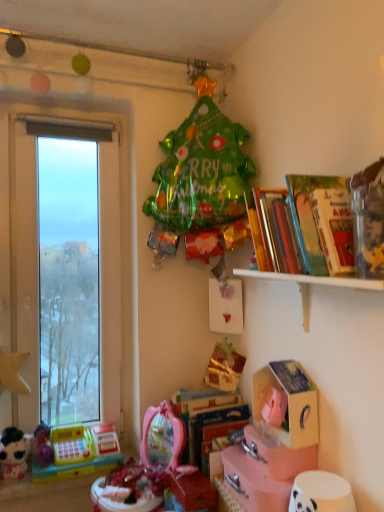
Question: Is shiny pink toy at center, which appears as the 2th toy when viewed from the right, positioned behind hardcover book at center, the 2th book in the front-to-back sequence?

Choices:
 (A) yes
 (B) no

Answer: (B)

Question: Considering the relative positions of shiny pink toy at center, which appears as the 2th toy when viewed from the right, and hardcover book at center, which is counted as the 2th book, starting from the top, in the image provided, is shiny pink toy at center, which appears as the 2th toy when viewed from the right, in front of hardcover book at center, which is counted as the 2th book, starting from the top,?

Choices:
 (A) no
 (B) yes

Answer: (B)

Question: Is shiny pink toy at center, positioned as the third toy in left-to-right order, at the right side of hardcover book at center, placed as the first book when sorted from bottom to top?

Choices:
 (A) yes
 (B) no

Answer: (B)

Question: Can you confirm if shiny pink toy at center, which appears as the 2th toy when viewed from the right, is positioned to the left of hardcover book at center, placed as the first book when sorted from bottom to top?

Choices:
 (A) no
 (B) yes

Answer: (B)

Question: Considering the relative sizes of shiny pink toy at center, positioned as the third toy in left-to-right order, and hardcover book at center, which is counted as the 2th book, starting from the top, in the image provided, is shiny pink toy at center, positioned as the third toy in left-to-right order, taller than hardcover book at center, which is counted as the 2th book, starting from the top,?

Choices:
 (A) no
 (B) yes

Answer: (A)

Question: Considering the positions of yellow plastic cash register at lower left, which appears as the 2th toy when viewed from the left, and shiny pink mirror at lower center, which ranks as the first toy in right-to-left order, in the image, is yellow plastic cash register at lower left, which appears as the 2th toy when viewed from the left, bigger or smaller than shiny pink mirror at lower center, which ranks as the first toy in right-to-left order,?

Choices:
 (A) big
 (B) small

Answer: (B)

Question: From a real-world perspective, is yellow plastic cash register at lower left, which appears as the 2th toy when viewed from the left, positioned above or below shiny pink mirror at lower center, which ranks as the first toy in right-to-left order?

Choices:
 (A) above
 (B) below

Answer: (B)

Question: Is yellow plastic cash register at lower left, the 3th toy viewed from the right, situated inside shiny pink mirror at lower center, which ranks as the first toy in right-to-left order, or outside?

Choices:
 (A) outside
 (B) inside

Answer: (A)

Question: Is point (56, 459) closer or farther from the camera than point (201, 499)?

Choices:
 (A) closer
 (B) farther

Answer: (B)

Question: Does point (319, 262) appear closer or farther from the camera than point (147, 480)?

Choices:
 (A) closer
 (B) farther

Answer: (A)

Question: Is hardcover book at upper right, the second book when ordered from bottom to top, taller or shorter than shiny pink toy at center, which appears as the 2th toy when viewed from the right?

Choices:
 (A) short
 (B) tall

Answer: (B)

Question: Is hardcover book at upper right, arranged as the 1th book when viewed from the front, in front of or behind shiny pink toy at center, which appears as the 2th toy when viewed from the right, in the image?

Choices:
 (A) front
 (B) behind

Answer: (A)

Question: In terms of width, does hardcover book at upper right, the second book when ordered from bottom to top, look wider or thinner when compared to shiny pink toy at center, which appears as the 2th toy when viewed from the right?

Choices:
 (A) thin
 (B) wide

Answer: (B)

Question: From their relative heights in the image, would you say pink cardboard box at lower center, which is the 1th cardboard box from bottom to top, is taller or shorter than shiny pink toy at center, which appears as the 2th toy when viewed from the right?

Choices:
 (A) tall
 (B) short

Answer: (B)

Question: In terms of width, does pink cardboard box at lower center, the second cardboard box from the top, look wider or thinner when compared to shiny pink toy at center, which appears as the 2th toy when viewed from the right?

Choices:
 (A) thin
 (B) wide

Answer: (B)